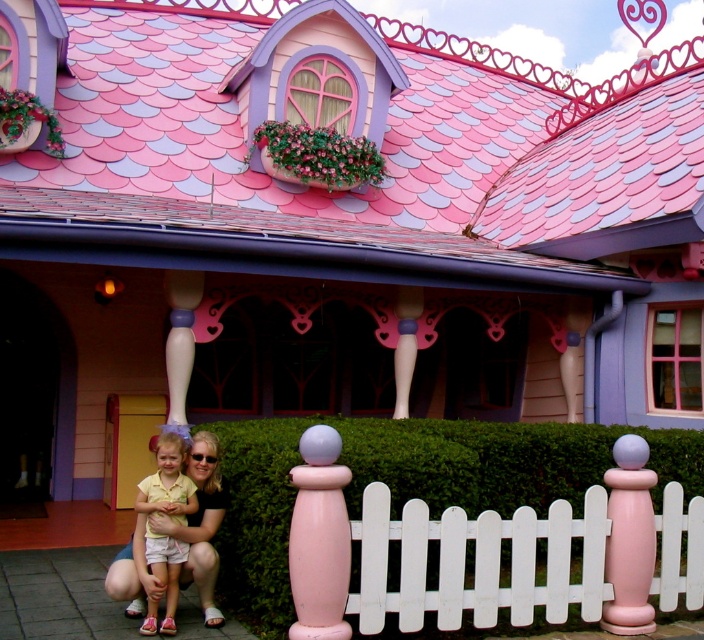
Based on the photo, can you confirm if white picket fence at center is wider than pastel yellow shirt at lower left?

Yes, white picket fence at center is wider than pastel yellow shirt at lower left.

From the picture: Does white picket fence at center have a greater height compared to pastel yellow shirt at lower left?

Incorrect, white picket fence at center's height is not larger of pastel yellow shirt at lower left's.

Does point (684, 580) come closer to viewer compared to point (165, 552)?

No, it is behind (165, 552).

This screenshot has width=704, height=640. Find the location of `white picket fence at center`. white picket fence at center is located at coordinates (479, 563).

Does green hedge at center have a lesser width compared to white picket fence at center?

Yes, green hedge at center is thinner than white picket fence at center.

Which is behind, point (260, 467) or point (446, 548)?

Point (260, 467)

Which is behind, point (358, 467) or point (425, 579)?

Point (358, 467)

I want to click on green hedge at center, so click(x=415, y=481).

Is green hedge at center bigger than pastel yellow shirt at lower left?

Correct, green hedge at center is larger in size than pastel yellow shirt at lower left.

Between point (584, 460) and point (168, 573), which one is positioned in front?

Point (168, 573) is in front.

Where is `green hedge at center`? The height and width of the screenshot is (640, 704). green hedge at center is located at coordinates (415, 481).